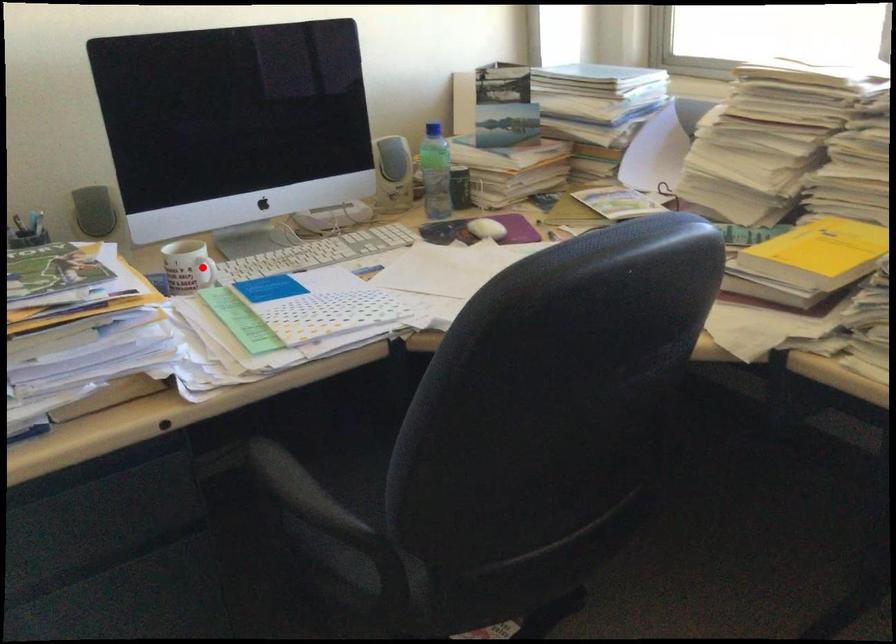
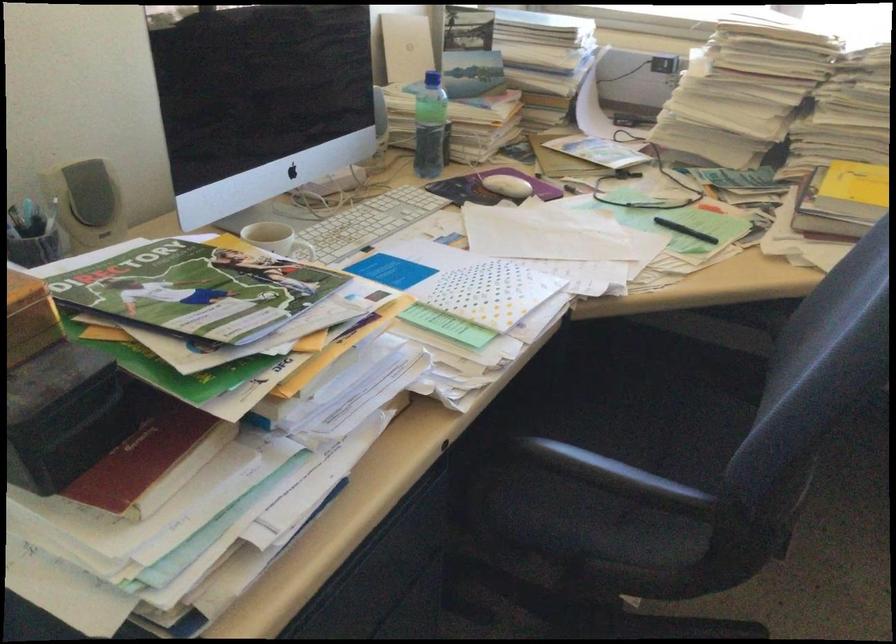
Question: I am providing you with two images of the same scene from different viewpoints. A red point is marked on the first image. Is the red point's position out of view in image 2?

Choices:
 (A) Yes
 (B) No

Answer: (B)